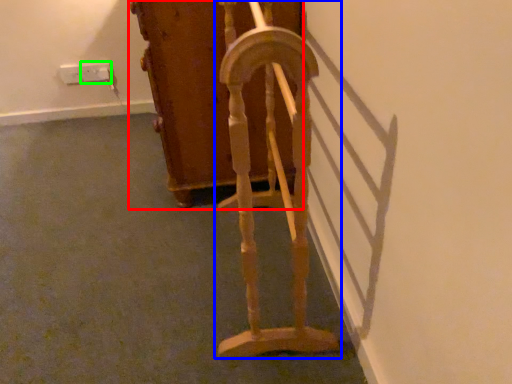
Question: Based on their relative distances, which object is nearer to furniture (highlighted by a red box)? Choose from furniture (highlighted by a blue box) and electric outlet (highlighted by a green box).

Choices:
 (A) furniture
 (B) electric outlet

Answer: (A)